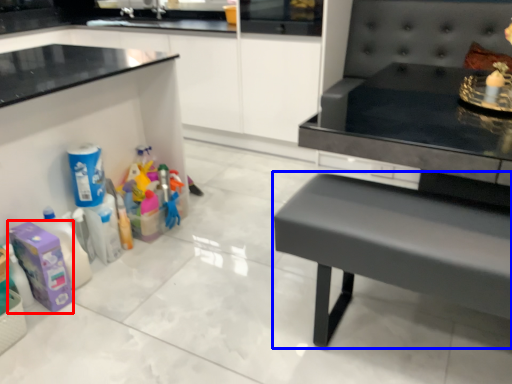
Question: Which of the following is the farthest to the observer, cleaning product (highlighted by a red box) or table (highlighted by a blue box)?

Choices:
 (A) cleaning product
 (B) table

Answer: (A)